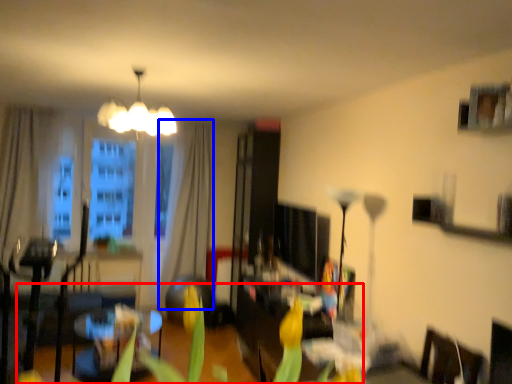
Question: Among these objects, which one is farthest to the camera, plant (highlighted by a red box) or curtain (highlighted by a blue box)?

Choices:
 (A) plant
 (B) curtain

Answer: (B)